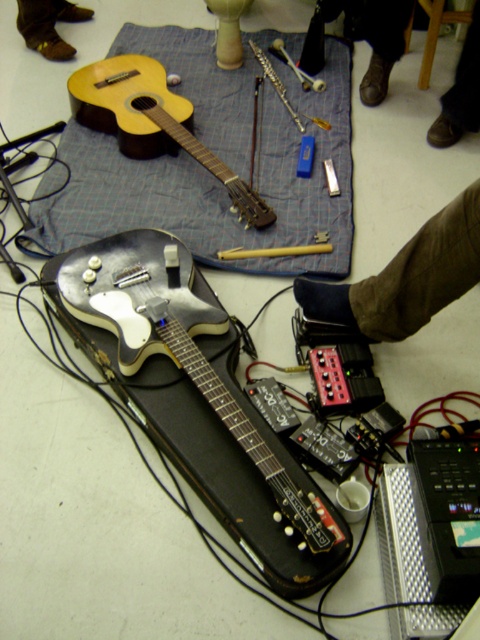
Is blue fabric guitar at center taller than matte wood guitar at upper left?

Indeed, blue fabric guitar at center has a greater height compared to matte wood guitar at upper left.

Between blue fabric guitar at center and matte wood guitar at upper left, which one has more height?

blue fabric guitar at center is taller.

Is point (145, 44) positioned in front of point (252, 218)?

No.

Locate an element on the screen. blue fabric guitar at center is located at coordinates (218, 184).

Between metallic silver electric guitar at center and dark blue fabric at lower right, which one appears on the right side from the viewer's perspective?

Positioned to the right is dark blue fabric at lower right.

Based on the photo, between metallic silver electric guitar at center and dark blue fabric at lower right, which one is positioned lower?

metallic silver electric guitar at center is below.

Image resolution: width=480 pixels, height=640 pixels. Describe the element at coordinates (195, 397) in the screenshot. I see `metallic silver electric guitar at center` at that location.

Image resolution: width=480 pixels, height=640 pixels. I want to click on metallic silver electric guitar at center, so click(195, 397).

Is matte wood guitar at upper left below brown leather shoe at lower right?

Indeed, matte wood guitar at upper left is positioned under brown leather shoe at lower right.

Does matte wood guitar at upper left have a greater height compared to brown leather shoe at lower right?

Indeed, matte wood guitar at upper left has a greater height compared to brown leather shoe at lower right.

Is point (122, 60) positioned before point (474, 116)?

No, it is behind (474, 116).

Where is `matte wood guitar at upper left`? The width and height of the screenshot is (480, 640). matte wood guitar at upper left is located at coordinates (152, 122).